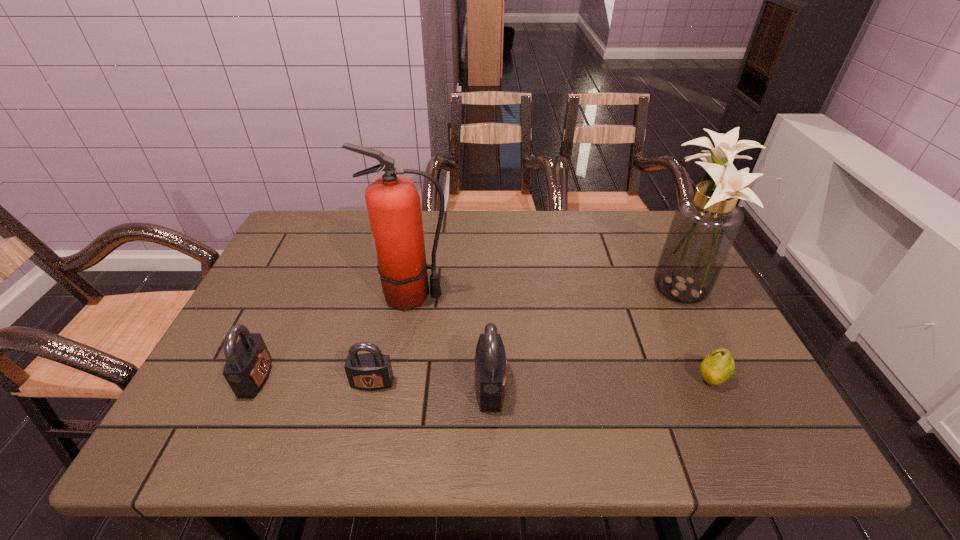
Where is `free space between the shortest padlock and the fourth object from left to right`? This screenshot has height=540, width=960. free space between the shortest padlock and the fourth object from left to right is located at coordinates (431, 384).

Where is `free space that is in between the second tallest padlock and the flower arrangement`? free space that is in between the second tallest padlock and the flower arrangement is located at coordinates (465, 332).

Find the location of a particular element. This screenshot has width=960, height=540. empty space between the rightmost padlock and the flower arrangement is located at coordinates (582, 336).

Identify the location of vacant space that's between the leftmost object and the flower arrangement. The width and height of the screenshot is (960, 540). (465, 332).

Identify the location of the fifth closest object relative to the fire extinguisher. This screenshot has width=960, height=540. (718, 366).

What are the coordinates of `object that is the second closest one to the pear` in the screenshot? It's located at (490, 358).

Identify which padlock is the nearest to the third object from right to left. Please provide its 2D coordinates. Your answer should be formatted as a tuple, i.e. [(x, y)], where the tuple contains the x and y coordinates of a point satisfying the conditions above.

[(370, 371)]

Choose which padlock is the nearest neighbor to the fourth object from left to right. Please provide its 2D coordinates. Your answer should be formatted as a tuple, i.e. [(x, y)], where the tuple contains the x and y coordinates of a point satisfying the conditions above.

[(370, 371)]

Locate an element on the screen. free spot that satisfies the following two spatial constraints: 1. on the front of the fourth tallest object near the keyhole; 2. on the right side of the pear is located at coordinates (255, 379).

In order to click on free region that satisfies the following two spatial constraints: 1. on the front of the second shortest padlock near the keyhole; 2. on the back side of the shortest object in this screenshot , I will do `click(255, 379)`.